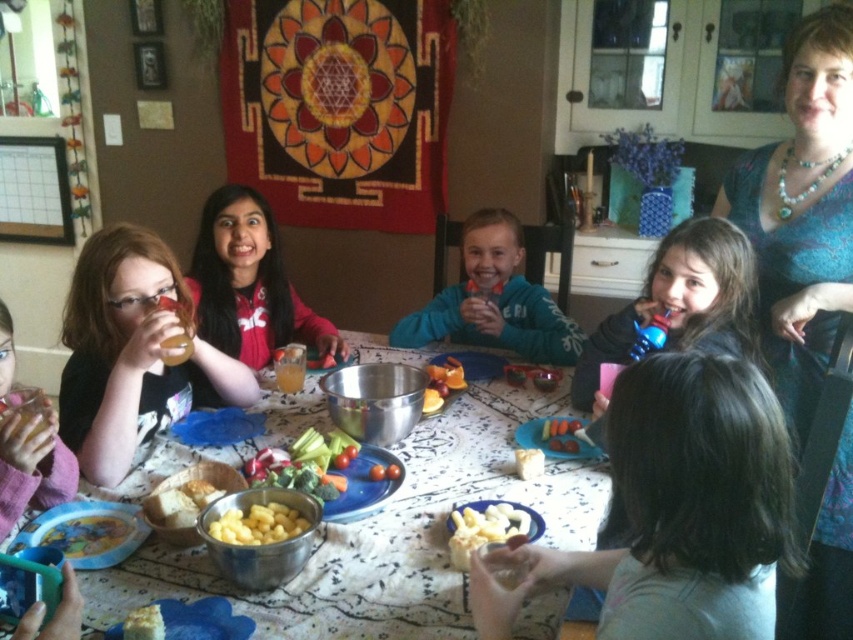
Question: Does pink fabric bib at lower left appear on the left side of orange fleshed fruit at center?

Choices:
 (A) no
 (B) yes

Answer: (B)

Question: Which of these objects is positioned farthest from the teal textured blouse at upper right?

Choices:
 (A) fresh green vegetables at center
 (B) smooth blue toothbrush at lower right
 (C) pink fabric bib at lower left

Answer: (C)

Question: Where is orange fleshed fruit at center located in relation to smooth yellow cheese at center in the image?

Choices:
 (A) above
 (B) below

Answer: (A)

Question: Which object is positioned closest to the fresh green vegetables at center?

Choices:
 (A) matte black hoodie at center
 (B) smooth blue toothbrush at lower right

Answer: (A)

Question: Estimate the real-world distances between objects in this image. Which object is farther from the orange fleshed fruit at center?

Choices:
 (A) pink fabric bib at lower left
 (B) translucent glass juice at center
 (C) white crumbly bread at lower left

Answer: (C)

Question: Does teal textured blouse at upper right appear on the right side of pink fabric bib at lower left?

Choices:
 (A) no
 (B) yes

Answer: (B)